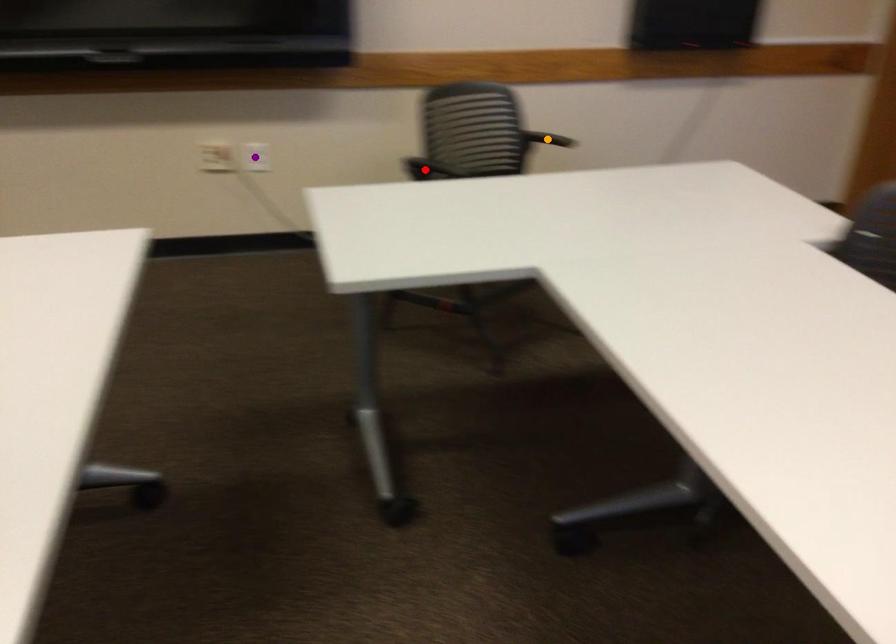
Order these from nearest to farthest:
1. purple point
2. red point
3. orange point

red point, purple point, orange point